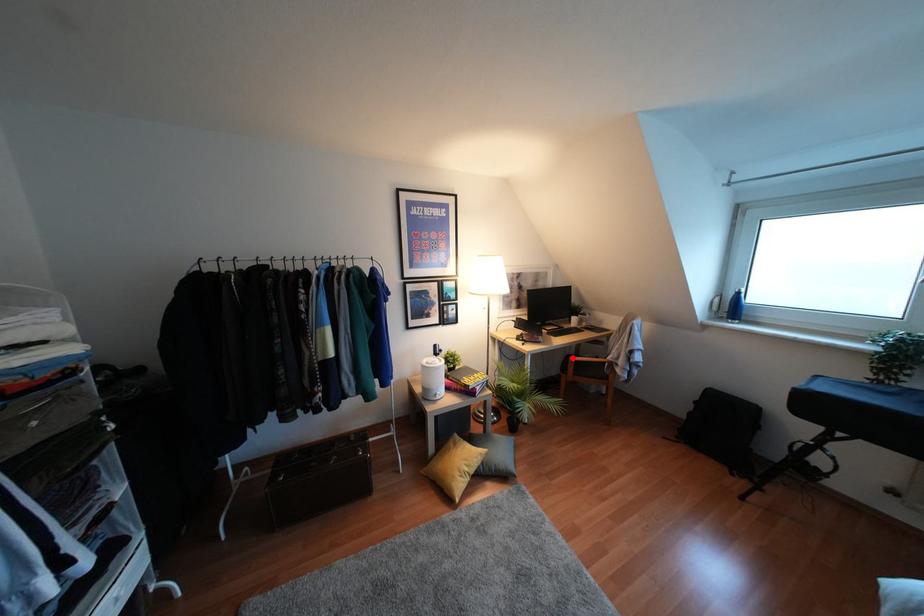
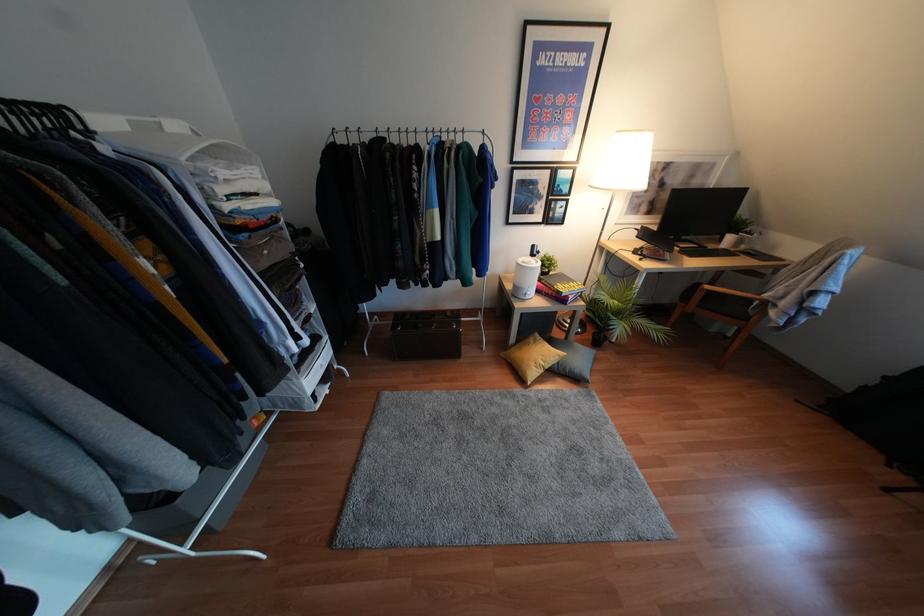
Question: I am providing you with two images of the same scene from different viewpoints. Given a red point in image1, look at the same physical point in image2. Is it:

Choices:
 (A) Closer to the viewpoint
 (B) Farther from the viewpoint

Answer: (A)